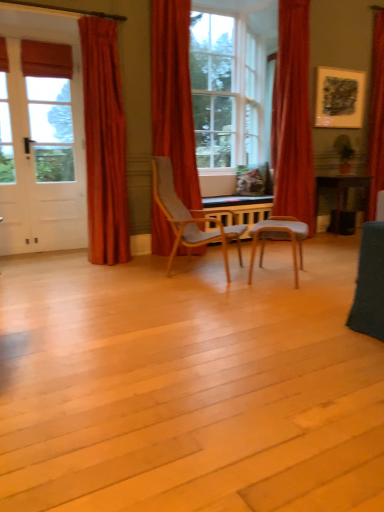
What do you see at coordinates (174, 96) in the screenshot?
I see `velvet red curtain at center, placed as the 2th curtain when sorted from left to right` at bounding box center [174, 96].

Find the location of a particular element. The width and height of the screenshot is (384, 512). wooden desk at right is located at coordinates (343, 193).

What do you see at coordinates (376, 114) in the screenshot?
I see `red velvet curtain at right, the first curtain in the right-to-left sequence` at bounding box center [376, 114].

Image resolution: width=384 pixels, height=512 pixels. I want to click on red velvet curtain at right, which is counted as the 4th curtain, starting from the left, so click(x=376, y=114).

Describe the element at coordinates (226, 90) in the screenshot. I see `matte glass window at center` at that location.

You are a GUI agent. You are given a task and a screenshot of the screen. Output one action in this format:
    pyautogui.click(x=<x>, y=<y>)
    Task: Click on the velvet red curtain at right, the second curtain positioned from the right
    The width and height of the screenshot is (384, 512).
    Given the screenshot: What is the action you would take?
    pyautogui.click(x=293, y=117)

The height and width of the screenshot is (512, 384). What do you see at coordinates (293, 117) in the screenshot?
I see `velvet red curtain at right, the second curtain positioned from the right` at bounding box center [293, 117].

Find the location of a particular element. wooden chair at center, which ranks as the 2th chair in left-to-right order is located at coordinates (278, 239).

Do you think red velvet curtain at right, which is counted as the 4th curtain, starting from the left, is within velvet red curtain at right, the 3th curtain viewed from the left, or outside of it?

red velvet curtain at right, which is counted as the 4th curtain, starting from the left, lies outside velvet red curtain at right, the 3th curtain viewed from the left.

Measure the distance from red velvet curtain at right, the first curtain in the right-to-left sequence, to velvet red curtain at right, the 3th curtain viewed from the left.

red velvet curtain at right, the first curtain in the right-to-left sequence, is 1.30 meters from velvet red curtain at right, the 3th curtain viewed from the left.

Which is more to the right, red velvet curtain at right, the first curtain in the right-to-left sequence, or velvet red curtain at right, the 3th curtain viewed from the left?

From the viewer's perspective, red velvet curtain at right, the first curtain in the right-to-left sequence, appears more on the right side.

Does red velvet curtain at right, the first curtain in the right-to-left sequence, have a greater width compared to velvet red curtain at right, the second curtain positioned from the right?

Correct, the width of red velvet curtain at right, the first curtain in the right-to-left sequence, exceeds that of velvet red curtain at right, the second curtain positioned from the right.

How many degrees apart are the facing directions of light gray fabric chair at center, placed as the first chair when sorted from left to right, and green matte houseplant at upper right?

The angle between the facing direction of light gray fabric chair at center, placed as the first chair when sorted from left to right, and the facing direction of green matte houseplant at upper right is 41.9 degrees.

Is the depth of light gray fabric chair at center, the 2th chair viewed from the right, less than that of green matte houseplant at upper right?

Yes, it is in front of green matte houseplant at upper right.

Could you tell me if light gray fabric chair at center, placed as the first chair when sorted from left to right, is turned towards green matte houseplant at upper right?

No, light gray fabric chair at center, placed as the first chair when sorted from left to right, is not aimed at green matte houseplant at upper right.

Considering the sizes of light gray fabric chair at center, placed as the first chair when sorted from left to right, and green matte houseplant at upper right in the image, is light gray fabric chair at center, placed as the first chair when sorted from left to right, wider or thinner than green matte houseplant at upper right?

Considering their sizes, light gray fabric chair at center, placed as the first chair when sorted from left to right, looks broader than green matte houseplant at upper right.

In the scene shown: From a real-world perspective, is matte glass window at center physically below velvet red curtain at center, the 3th curtain positioned from the right?

Actually, matte glass window at center is physically above velvet red curtain at center, the 3th curtain positioned from the right, in the real world.

Between matte glass window at center and velvet red curtain at center, the 3th curtain positioned from the right, which one has larger size?

Bigger between the two is matte glass window at center.

Is matte glass window at center in contact with velvet red curtain at center, the 3th curtain positioned from the right?

They are not placed beside each other.

From a real-world perspective, does green matte houseplant at upper right sit lower than velvet red curtain at center, the 3th curtain positioned from the right?

Indeed, from a real-world perspective, green matte houseplant at upper right is positioned beneath velvet red curtain at center, the 3th curtain positioned from the right.

Looking at this image, considering the relative sizes of green matte houseplant at upper right and velvet red curtain at center, the 3th curtain positioned from the right, in the image provided, is green matte houseplant at upper right thinner than velvet red curtain at center, the 3th curtain positioned from the right,?

Yes, green matte houseplant at upper right is thinner than velvet red curtain at center, the 3th curtain positioned from the right.

Can you confirm if green matte houseplant at upper right is positioned to the left of velvet red curtain at center, the 3th curtain positioned from the right?

Incorrect, green matte houseplant at upper right is not on the left side of velvet red curtain at center, the 3th curtain positioned from the right.

Visually, is matte glass window at center positioned to the left or to the right of velvet orange curtain at left, which appears as the 1th curtain when viewed from the left?

In the image, matte glass window at center appears on the right side of velvet orange curtain at left, which appears as the 1th curtain when viewed from the left.

Is matte glass window at center not close to velvet orange curtain at left, which appears as the 1th curtain when viewed from the left?

matte glass window at center is far away from velvet orange curtain at left, which appears as the 1th curtain when viewed from the left.

Could you tell me if matte glass window at center is turned towards velvet orange curtain at left, the fourth curtain viewed from the right?

No, matte glass window at center is not oriented towards velvet orange curtain at left, the fourth curtain viewed from the right.

Which of these two, matte glass window at center or velvet orange curtain at left, the fourth curtain viewed from the right, is wider?

matte glass window at center.

From the image's perspective, is velvet red curtain at center, placed as the 2th curtain when sorted from left to right, above red velvet curtain at right, the first curtain in the right-to-left sequence?

No, from the image's perspective, velvet red curtain at center, placed as the 2th curtain when sorted from left to right, is not on top of red velvet curtain at right, the first curtain in the right-to-left sequence.

In the image, is velvet red curtain at center, placed as the 2th curtain when sorted from left to right, positioned in front of or behind red velvet curtain at right, the first curtain in the right-to-left sequence?

velvet red curtain at center, placed as the 2th curtain when sorted from left to right, is in front of red velvet curtain at right, the first curtain in the right-to-left sequence.

Which of these two, velvet red curtain at center, the 3th curtain positioned from the right, or red velvet curtain at right, which is counted as the 4th curtain, starting from the left, stands taller?

Standing taller between the two is velvet red curtain at center, the 3th curtain positioned from the right.

Is velvet red curtain at center, the 3th curtain positioned from the right, surrounding red velvet curtain at right, which is counted as the 4th curtain, starting from the left?

No, red velvet curtain at right, which is counted as the 4th curtain, starting from the left, is located outside of velvet red curtain at center, the 3th curtain positioned from the right.

Does red velvet curtain at right, the first curtain in the right-to-left sequence, have a smaller size compared to matte glass window at center?

Yes, red velvet curtain at right, the first curtain in the right-to-left sequence, is smaller than matte glass window at center.

This screenshot has height=512, width=384. I want to click on curtain that is the 2nd one when counting backward from the matte glass window at center, so click(x=376, y=114).

In order to click on the 1st curtain in front of the red velvet curtain at right, the first curtain in the right-to-left sequence in this screenshot , I will do `click(293, 117)`.

From the image's perspective, count 1st chairs downward from the green matte houseplant at upper right and point to it. Please provide its 2D coordinates.

[(190, 218)]

Looking at the image, which one is located further to matte black picture frame at upper right, light gray fabric chair at center, the 2th chair viewed from the right, or velvet orange curtain at left, the fourth curtain viewed from the right?

Among the two, velvet orange curtain at left, the fourth curtain viewed from the right, is located further to matte black picture frame at upper right.

Based on their spatial positions, is matte black picture frame at upper right or wooden chair at center, which is the first chair from right to left, closer to light gray fabric chair at center, the 2th chair viewed from the right?

The object closer to light gray fabric chair at center, the 2th chair viewed from the right, is wooden chair at center, which is the first chair from right to left.

Looking at the image, which one is located further to wooden chair at center, which ranks as the 2th chair in left-to-right order, velvet red curtain at center, the 3th curtain positioned from the right, or wooden desk at right?

wooden desk at right lies further to wooden chair at center, which ranks as the 2th chair in left-to-right order, than the other object.

Looking at the image, which one is located closer to matte glass window at center, velvet red curtain at center, placed as the 2th curtain when sorted from left to right, or velvet red curtain at right, the 3th curtain viewed from the left?

Based on the image, velvet red curtain at right, the 3th curtain viewed from the left, appears to be nearer to matte glass window at center.

From the image, which object appears to be farther from velvet orange curtain at left, the fourth curtain viewed from the right, wooden desk at right or velvet red curtain at right, the 3th curtain viewed from the left?

wooden desk at right lies further to velvet orange curtain at left, the fourth curtain viewed from the right, than the other object.

When comparing their distances from velvet red curtain at center, placed as the 2th curtain when sorted from left to right, does matte black picture frame at upper right or wooden desk at right seem further?

Based on the image, wooden desk at right appears to be further to velvet red curtain at center, placed as the 2th curtain when sorted from left to right.

Looking at the image, which one is located closer to red velvet curtain at right, the first curtain in the right-to-left sequence, light gray fabric chair at center, placed as the first chair when sorted from left to right, or velvet red curtain at center, placed as the 2th curtain when sorted from left to right?

The object closer to red velvet curtain at right, the first curtain in the right-to-left sequence, is velvet red curtain at center, placed as the 2th curtain when sorted from left to right.

When comparing their distances from velvet orange curtain at left, which appears as the 1th curtain when viewed from the left, does matte black picture frame at upper right or velvet red curtain at right, the second curtain positioned from the right, seem closer?

velvet red curtain at right, the second curtain positioned from the right.

I want to click on desk between light gray fabric chair at center, the 2th chair viewed from the right, and green matte houseplant at upper right from front to back, so click(343, 193).

Where is `curtain situated between velvet red curtain at center, the 3th curtain positioned from the right, and red velvet curtain at right, the first curtain in the right-to-left sequence, from left to right`? The height and width of the screenshot is (512, 384). curtain situated between velvet red curtain at center, the 3th curtain positioned from the right, and red velvet curtain at right, the first curtain in the right-to-left sequence, from left to right is located at coordinates (293, 117).

Find the location of `picture frame between velvet orange curtain at left, which appears as the 1th curtain when viewed from the left, and green matte houseplant at upper right from left to right`. picture frame between velvet orange curtain at left, which appears as the 1th curtain when viewed from the left, and green matte houseplant at upper right from left to right is located at coordinates (339, 98).

Where is `picture frame between velvet red curtain at center, placed as the 2th curtain when sorted from left to right, and green matte houseplant at upper right from left to right`? The height and width of the screenshot is (512, 384). picture frame between velvet red curtain at center, placed as the 2th curtain when sorted from left to right, and green matte houseplant at upper right from left to right is located at coordinates (339, 98).